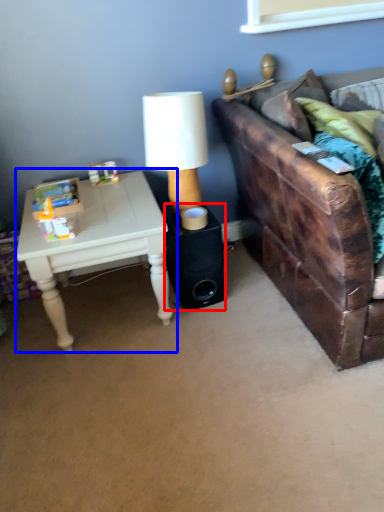
Question: Among these objects, which one is farthest to the camera, speaker (highlighted by a red box) or table (highlighted by a blue box)?

Choices:
 (A) speaker
 (B) table

Answer: (A)